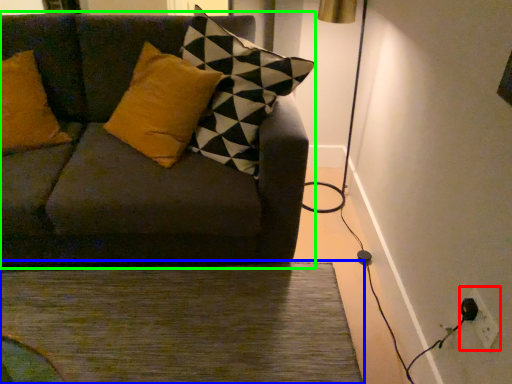
Question: Considering the real-world distances, which object is farthest from electric outlet (highlighted by a red box)? doormat (highlighted by a blue box) or studio couch (highlighted by a green box)?

Choices:
 (A) doormat
 (B) studio couch

Answer: (B)